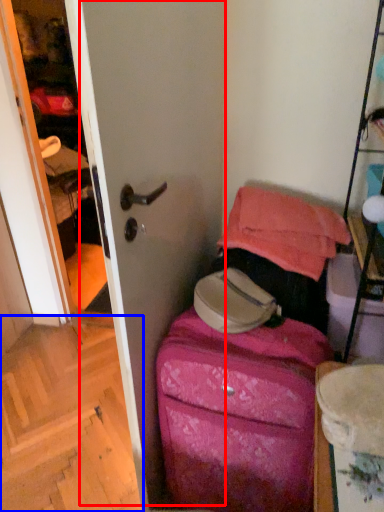
Question: Which object is further to the camera taking this photo, screen door (highlighted by a red box) or stairwell (highlighted by a blue box)?

Choices:
 (A) screen door
 (B) stairwell

Answer: (B)